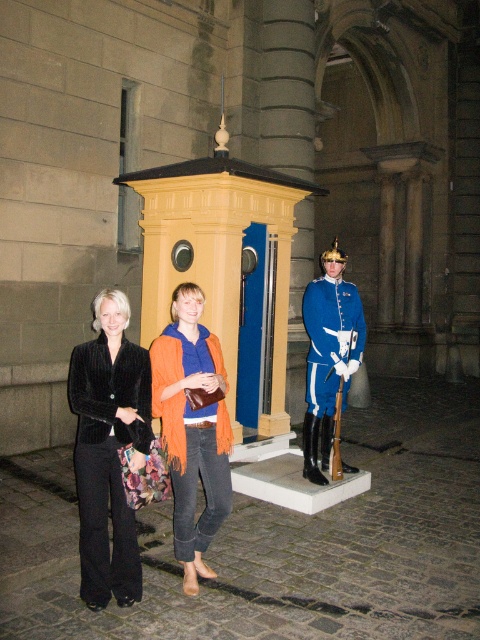
Question: Observing the image, what is the correct spatial positioning of velvet black uniform at center in reference to blue glossy uniform at center?

Choices:
 (A) below
 (B) above

Answer: (A)

Question: Is velvet black uniform at center bigger than orange knitted scarf at center?

Choices:
 (A) no
 (B) yes

Answer: (A)

Question: Which point is farther to the camera?

Choices:
 (A) orange knitted scarf at center
 (B) blue glossy uniform at center
 (C) velvet black uniform at center

Answer: (B)

Question: Does velvet black uniform at center appear over blue glossy uniform at center?

Choices:
 (A) no
 (B) yes

Answer: (A)

Question: Which point appears farthest from the camera in this image?

Choices:
 (A) (155, 339)
 (B) (331, 378)
 (C) (135, 580)

Answer: (B)

Question: Which object is closer to the camera taking this photo?

Choices:
 (A) orange knitted scarf at center
 (B) blue glossy uniform at center
 (C) velvet black uniform at center

Answer: (C)